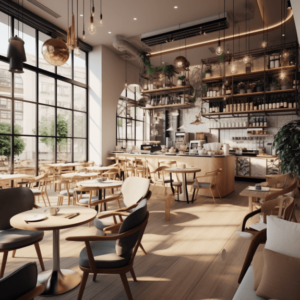
The image size is (300, 300). Identify the location of tables. (15, 177), (69, 165), (99, 167), (78, 175), (97, 183), (53, 213), (178, 170), (262, 193).